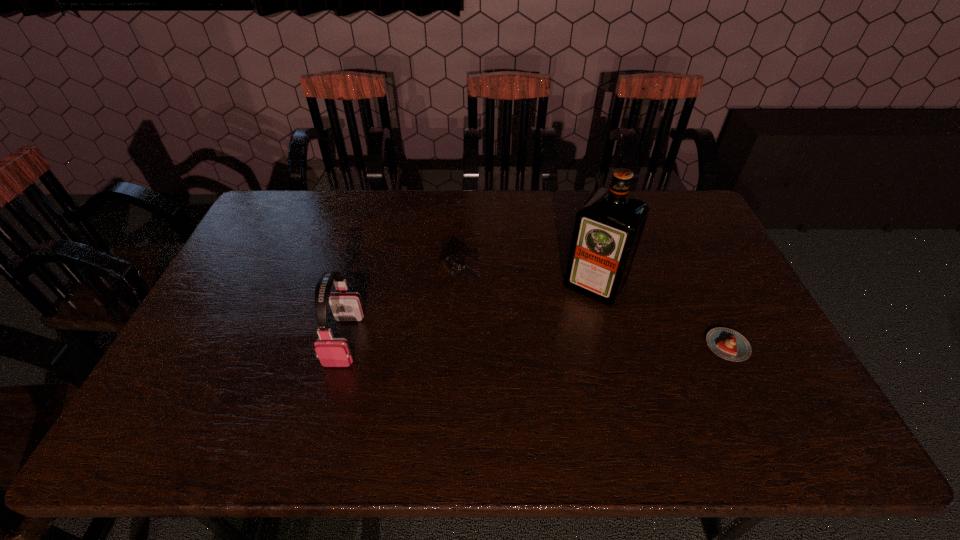
Find the location of a particular element. The image size is (960, 540). free spot on the desktop that is between the leftmost object and the rightmost object and is positioned at the barrel of the third tallest object is located at coordinates (548, 343).

Where is `vacant spot on the desktop that is between the earphone and the pastry and is positioned on the front label of the liquor`? vacant spot on the desktop that is between the earphone and the pastry and is positioned on the front label of the liquor is located at coordinates (556, 343).